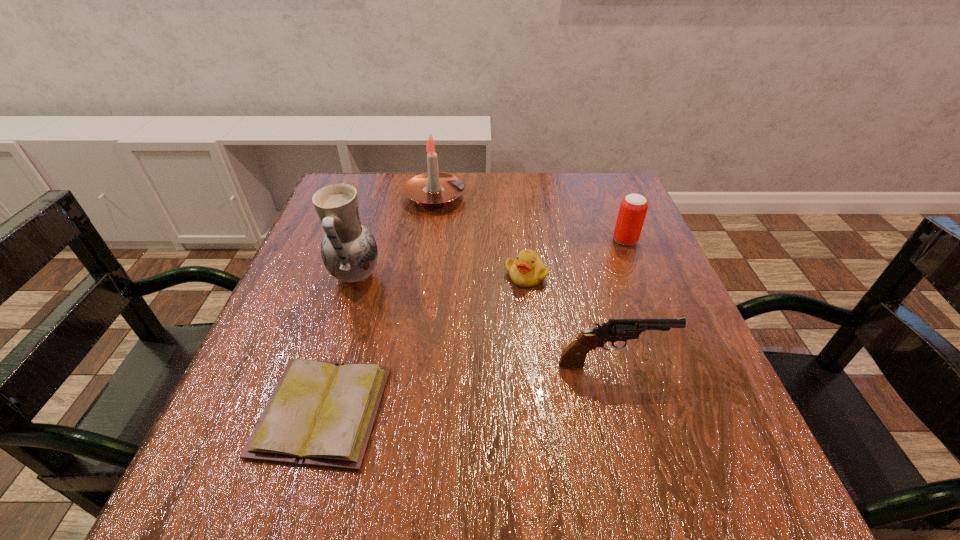
The height and width of the screenshot is (540, 960). I want to click on vacant space positioned 0.110m on the left of the beer can, so click(x=565, y=240).

I want to click on free space located on the front-facing side of the duckling, so pos(540,396).

Find the location of a particular element. free space located 0.260m on the right of the shortest object is located at coordinates (549, 411).

Identify the location of object that is at the far edge. (434, 189).

You are a GUI agent. You are given a task and a screenshot of the screen. Output one action in this format:
    pyautogui.click(x=<x>, y=<y>)
    Task: Click on the object at the near edge
    The width and height of the screenshot is (960, 540).
    Given the screenshot: What is the action you would take?
    pyautogui.click(x=321, y=413)

Identify the location of pottery located in the left edge section of the desktop. Image resolution: width=960 pixels, height=540 pixels. (349, 252).

Locate an element on the screen. This screenshot has height=540, width=960. diary that is at the left edge is located at coordinates (321, 413).

In order to click on gun located in the right edge section of the desktop in this screenshot , I will do `click(573, 356)`.

I want to click on beer can located in the right edge section of the desktop, so tap(633, 208).

Locate an element on the screen. object located at the near left corner is located at coordinates (321, 413).